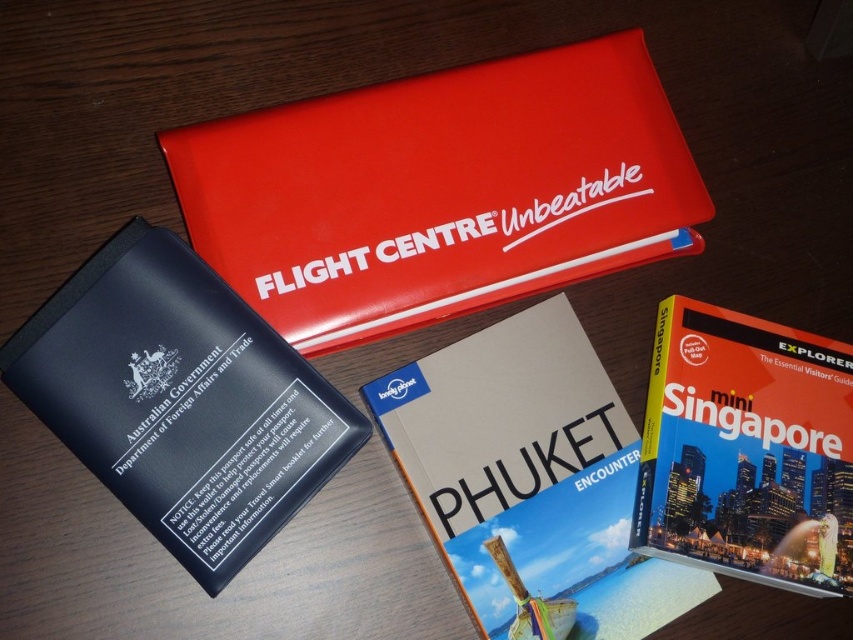
You are a travel agent arranging items on a desk. You have a red booklet labeled FLIGHT CENTRE Unbeatable at the top left and a black passport holder from the Australian Government at the bottom right. There is also a hardcover book at center. The two guidebooks are 1.07 meters apart. A customer asks if they can fit both guidebooks on a shelf that is 1.2 meters long. Can they fit?

The two guidebooks are 1.07 meters apart, so they can fit on a 1.2 meter shelf since 1.07 meters is less than 1.2 meters.